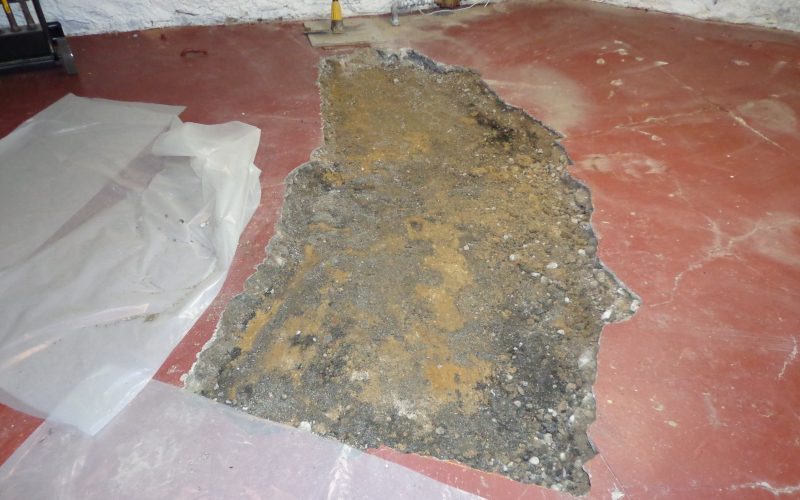
The width and height of the screenshot is (800, 500). I want to click on white wall, so click(x=126, y=19), click(x=733, y=6).